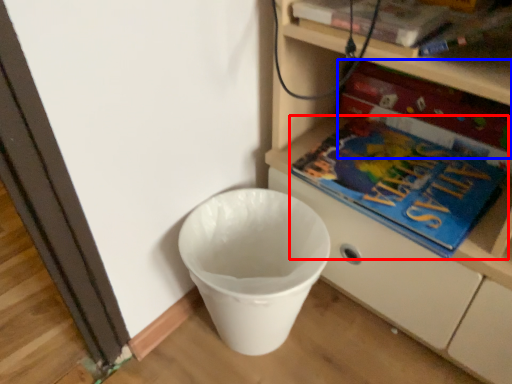
Question: Which object appears closest to the camera in this image, book (highlighted by a red box) or paperback book (highlighted by a blue box)?

Choices:
 (A) book
 (B) paperback book

Answer: (A)